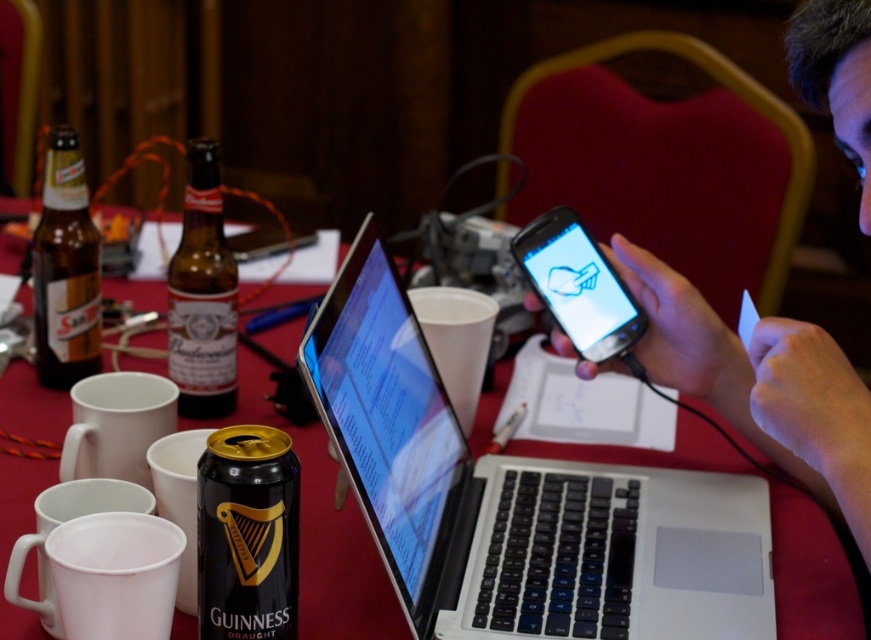
Locate an element on the screen. This screenshot has height=640, width=871. black matte can at center-left is located at coordinates (247, 534).

From the picture: Does black matte can at center-left have a smaller size compared to brown glass bottle at left?

Yes, black matte can at center-left is smaller than brown glass bottle at left.

This screenshot has height=640, width=871. What do you see at coordinates (247, 534) in the screenshot? I see `black matte can at center-left` at bounding box center [247, 534].

Identify the location of black matte can at center-left. The width and height of the screenshot is (871, 640). 247,534.

Can you confirm if silver/black laptop at center is wider than matte black phone at center?

Indeed, silver/black laptop at center has a greater width compared to matte black phone at center.

Is point (382, 429) in front of point (541, 278)?

Yes, point (382, 429) is closer to viewer.

Is point (652, 528) less distant than point (598, 285)?

That is True.

What are the coordinates of `silver/black laptop at center` in the screenshot? It's located at (518, 497).

Consider the image. Which of these two, smooth skin hand at upper right or black matte can at center-left, stands shorter?

black matte can at center-left is shorter.

This screenshot has height=640, width=871. I want to click on smooth skin hand at upper right, so click(761, 385).